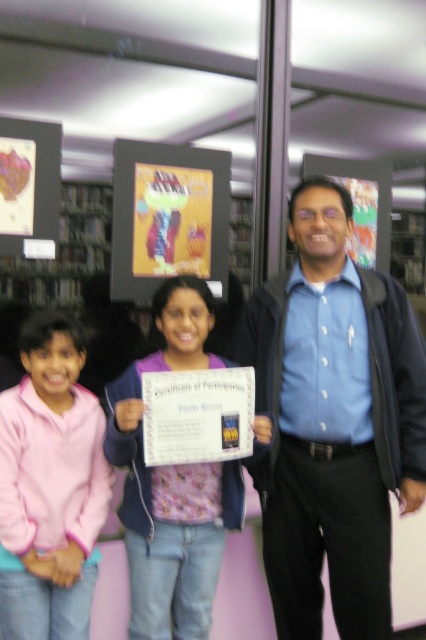
You are organizing a school event and need to arrange two shirts on a display table. The blue shirt at center and the pink fabric shirt at center must be placed side by side. Which shirt should you place on the left to ensure the display looks balanced?

The blue shirt at center has a larger width than the pink fabric shirt at center, so placing the wider blue shirt at center on the left would create a balanced display.

What is the position of the pink fleece jacket at lower left in the image?

The pink fleece jacket at lower left is located at point (49,486).